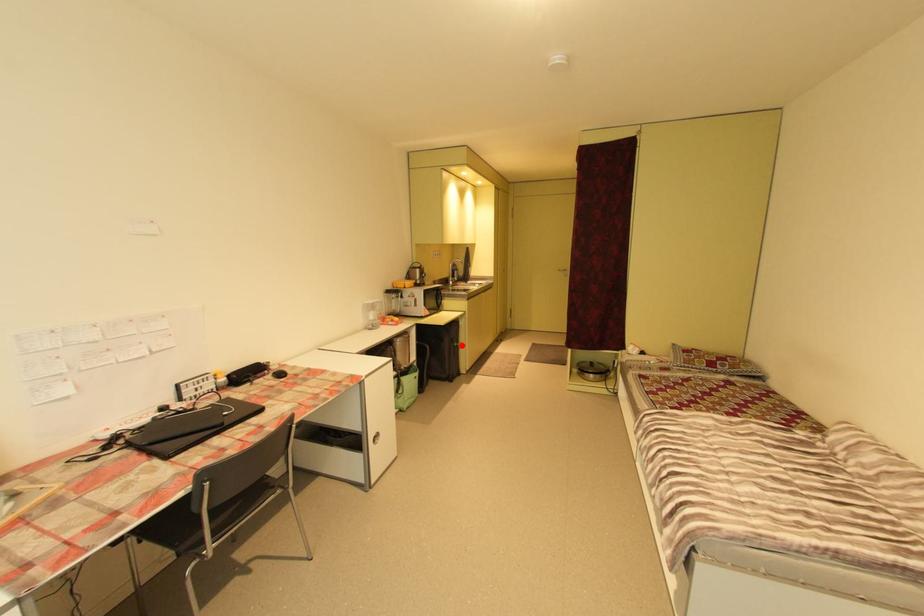
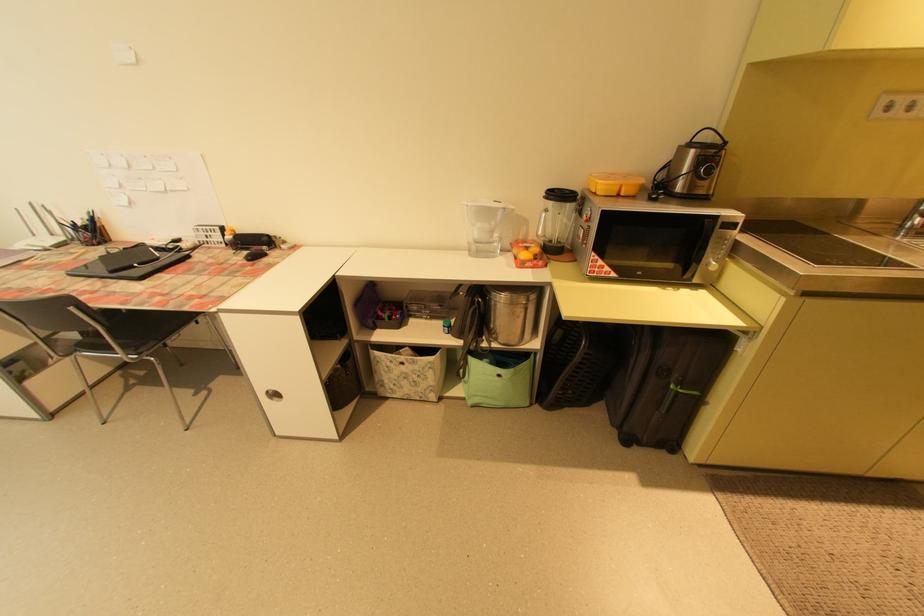
Question: I am providing you with two images of the same scene from different viewpoints. Given a red point in image1, look at the same physical point in image2. Is it:

Choices:
 (A) Closer to the viewpoint
 (B) Farther from the viewpoint

Answer: (B)